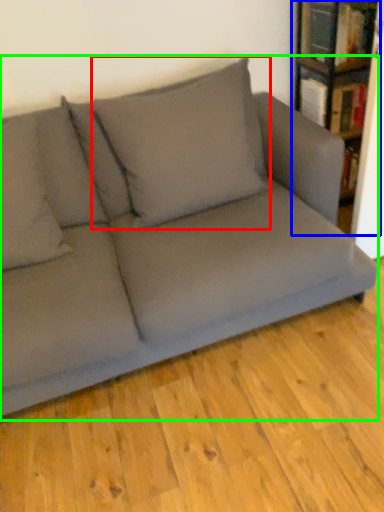
Question: Estimate the real-world distances between objects in this image. Which object is farther from pillow (highlighted by a red box), bookcase (highlighted by a blue box) or studio couch (highlighted by a green box)?

Choices:
 (A) bookcase
 (B) studio couch

Answer: (A)